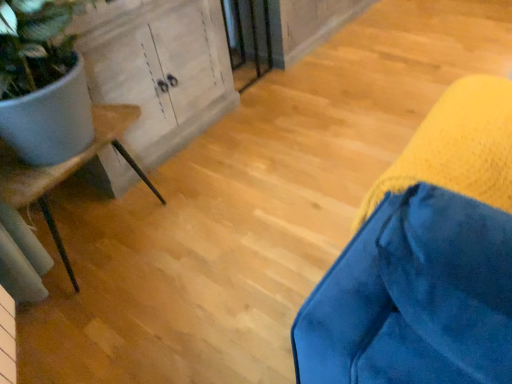
Question: Does wooden screen door at center contain velvet blue cushion at lower right, which is the second furniture from left to right?

Choices:
 (A) yes
 (B) no

Answer: (B)

Question: Can you confirm if wooden screen door at center is thinner than velvet blue cushion at lower right, placed as the 1th furniture when sorted from front to back?

Choices:
 (A) no
 (B) yes

Answer: (A)

Question: Considering the relative positions of wooden screen door at center and velvet blue cushion at lower right, which is the 1th furniture from right to left, in the image provided, is wooden screen door at center to the left of velvet blue cushion at lower right, which is the 1th furniture from right to left, from the viewer's perspective?

Choices:
 (A) yes
 (B) no

Answer: (A)

Question: Is wooden screen door at center positioned in front of velvet blue cushion at lower right, which is the second furniture from left to right?

Choices:
 (A) no
 (B) yes

Answer: (A)

Question: Is wooden screen door at center oriented away from velvet blue cushion at lower right, the 2th furniture in the back-to-front sequence?

Choices:
 (A) yes
 (B) no

Answer: (B)

Question: In the image, is wooden cabinet at left on the left side or the right side of wooden screen door at center?

Choices:
 (A) right
 (B) left

Answer: (B)

Question: Looking at the image, does wooden cabinet at left seem bigger or smaller compared to wooden screen door at center?

Choices:
 (A) big
 (B) small

Answer: (A)

Question: Considering the positions of wooden cabinet at left and wooden screen door at center in the image, is wooden cabinet at left taller or shorter than wooden screen door at center?

Choices:
 (A) tall
 (B) short

Answer: (A)

Question: Considering the positions of wooden cabinet at left and wooden screen door at center in the image, is wooden cabinet at left wider or thinner than wooden screen door at center?

Choices:
 (A) wide
 (B) thin

Answer: (A)

Question: Considering the positions of velvet blue cushion at lower right, which is the second furniture from left to right, and wooden cabinet at left in the image, is velvet blue cushion at lower right, which is the second furniture from left to right, wider or thinner than wooden cabinet at left?

Choices:
 (A) wide
 (B) thin

Answer: (B)

Question: Is velvet blue cushion at lower right, the 2th furniture in the back-to-front sequence, taller or shorter than wooden cabinet at left?

Choices:
 (A) tall
 (B) short

Answer: (B)

Question: In the image, is velvet blue cushion at lower right, which is the 1th furniture from right to left, positioned in front of or behind wooden cabinet at left?

Choices:
 (A) behind
 (B) front

Answer: (B)

Question: Is velvet blue cushion at lower right, placed as the 1th furniture when sorted from front to back, bigger or smaller than wooden cabinet at left?

Choices:
 (A) big
 (B) small

Answer: (B)

Question: Is velvet blue cushion at lower right, which is the 1th furniture from right to left, inside or outside of white matte plant pot at left, arranged as the 1th furniture when viewed from the left?

Choices:
 (A) inside
 (B) outside

Answer: (B)

Question: Is velvet blue cushion at lower right, which is the 1th furniture from right to left, in front of or behind white matte plant pot at left, the 1th furniture in the back-to-front sequence, in the image?

Choices:
 (A) behind
 (B) front

Answer: (B)